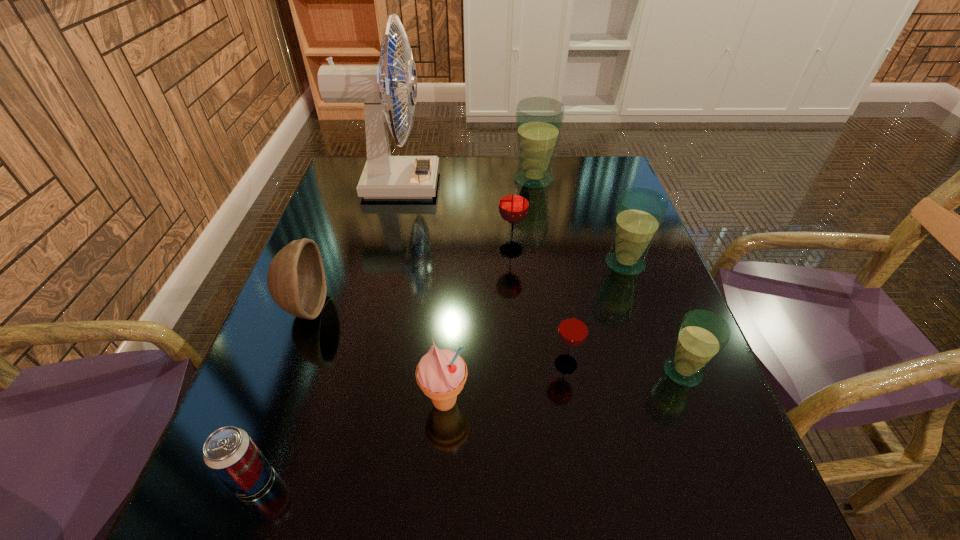
Where is `the smaller red glass`? the smaller red glass is located at coordinates (573, 328).

Find the location of a particular element. the right red glass is located at coordinates (573, 328).

This screenshot has height=540, width=960. What are the coordinates of `beer can` in the screenshot? It's located at (229, 452).

You are a GUI agent. You are given a task and a screenshot of the screen. Output one action in this format:
    pyautogui.click(x=<x>, y=<y>)
    Task: Click on the red beer can
    
    Given the screenshot: What is the action you would take?
    pyautogui.click(x=229, y=452)

Where is `vacant space situated 0.170m on the front-facing side of the tallest object`? vacant space situated 0.170m on the front-facing side of the tallest object is located at coordinates (495, 185).

This screenshot has height=540, width=960. What are the coordinates of `vacant space positioned on the right of the tallest glass` in the screenshot? It's located at (579, 180).

Locate an element on the screen. This screenshot has height=540, width=960. free spot located on the front of the left red glass is located at coordinates (520, 372).

This screenshot has height=540, width=960. I want to click on free location located on the left of the second smallest blue glass, so click(452, 264).

The image size is (960, 540). I want to click on free space located 0.150m on the back of the fifth farthest object, so click(331, 239).

Find the location of `free region located on the left of the fourth object from left to right`. free region located on the left of the fourth object from left to right is located at coordinates (321, 402).